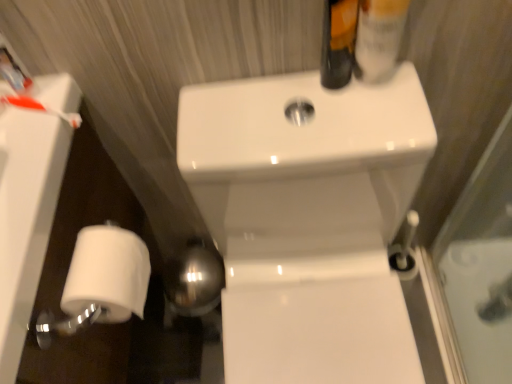
Find the location of a particular element. Image resolution: width=512 pixels, height=384 pixels. vacant space in front of matte black bottle at upper right is located at coordinates (349, 121).